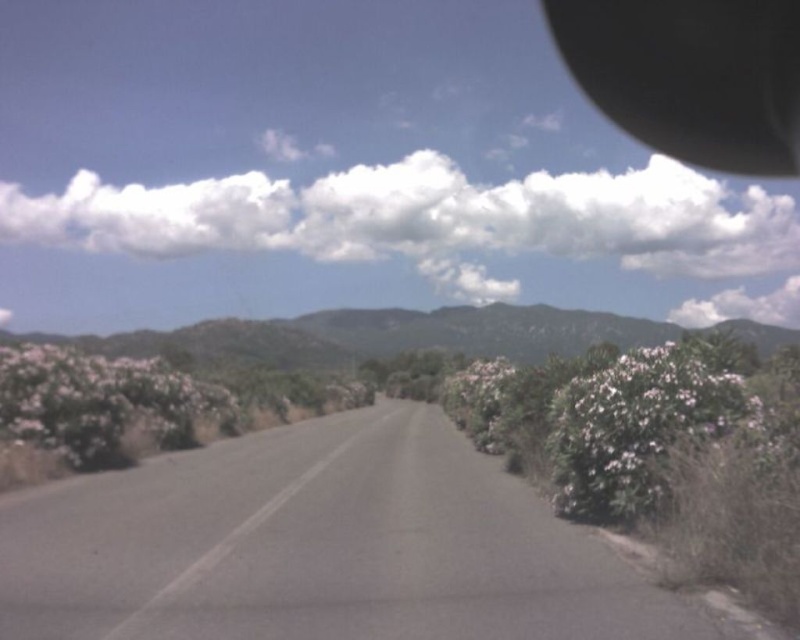
Can you confirm if gray asphalt road at center is positioned to the left of green textured mountain at center?

No, gray asphalt road at center is not to the left of green textured mountain at center.

Identify the location of gray asphalt road at center. (322, 547).

This screenshot has height=640, width=800. In order to click on gray asphalt road at center in this screenshot , I will do `click(322, 547)`.

Is gray asphalt road at center to the left of black rubber view mirror at upper right from the viewer's perspective?

Yes, gray asphalt road at center is to the left of black rubber view mirror at upper right.

Is point (256, 570) less distant than point (722, 45)?

That is True.

Where is `gray asphalt road at center`? The width and height of the screenshot is (800, 640). gray asphalt road at center is located at coordinates pos(322,547).

Between black rubber view mirror at upper right and green textured mountain at center, which one appears on the right side from the viewer's perspective?

From the viewer's perspective, black rubber view mirror at upper right appears more on the right side.

Is black rubber view mirror at upper right smaller than green textured mountain at center?

No, black rubber view mirror at upper right is not smaller than green textured mountain at center.

The height and width of the screenshot is (640, 800). Describe the element at coordinates (692, 76) in the screenshot. I see `black rubber view mirror at upper right` at that location.

You are a GUI agent. You are given a task and a screenshot of the screen. Output one action in this format:
    pyautogui.click(x=<x>, y=<y>)
    Task: Click on the black rubber view mirror at upper right
    
    Given the screenshot: What is the action you would take?
    pyautogui.click(x=692, y=76)